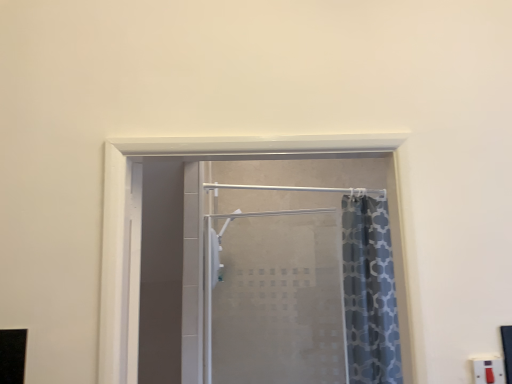
The image size is (512, 384). What do you see at coordinates (290, 275) in the screenshot?
I see `frosted glass shower door at center` at bounding box center [290, 275].

Find the location of `frosted glass shower door at center`. frosted glass shower door at center is located at coordinates pyautogui.click(x=290, y=275).

The width and height of the screenshot is (512, 384). What do you see at coordinates (488, 370) in the screenshot?
I see `white plastic electric outlet at lower right` at bounding box center [488, 370].

Find the location of a particular element. The image size is (512, 384). white plastic electric outlet at lower right is located at coordinates (488, 370).

Where is `frosted glass shower door at center`? frosted glass shower door at center is located at coordinates (290, 275).

Would you say frosted glass shower door at center is to the left or to the right of white plastic electric outlet at lower right in the picture?

In the image, frosted glass shower door at center appears on the left side of white plastic electric outlet at lower right.

Is frosted glass shower door at center in front of or behind white plastic electric outlet at lower right in the image?

In the image, frosted glass shower door at center appears behind white plastic electric outlet at lower right.

Does point (289, 316) come farther from viewer compared to point (487, 370)?

Yes, it is behind point (487, 370).

From the image's perspective, is frosted glass shower door at center over white plastic electric outlet at lower right?

No, from the image's perspective, frosted glass shower door at center is not over white plastic electric outlet at lower right.

In the scene shown: From a real-world perspective, does frosted glass shower door at center stand above white plastic electric outlet at lower right?

Correct, in the physical world, frosted glass shower door at center is higher than white plastic electric outlet at lower right.

Which of these two, frosted glass shower door at center or white plastic electric outlet at lower right, is wider?

frosted glass shower door at center.

Which of these two, frosted glass shower door at center or white plastic electric outlet at lower right, stands taller?

frosted glass shower door at center.

Which of these two, frosted glass shower door at center or white plastic electric outlet at lower right, is bigger?

With larger size is frosted glass shower door at center.

Choose the correct answer: Is frosted glass shower door at center inside white plastic electric outlet at lower right or outside it?

The correct answer is: outside.

Is frosted glass shower door at center far from white plastic electric outlet at lower right?

Absolutely, frosted glass shower door at center is distant from white plastic electric outlet at lower right.

Based on the photo, does frosted glass shower door at center turn towards white plastic electric outlet at lower right?

No, frosted glass shower door at center is not facing towards white plastic electric outlet at lower right.

Find the location of `electric outlet below the frosted glass shower door at center (from a real-world perspective)`. electric outlet below the frosted glass shower door at center (from a real-world perspective) is located at coordinates (488, 370).

Is white plastic electric outlet at lower right at the left side of frosted glass shower door at center?

No.

Considering the relative positions of white plastic electric outlet at lower right and frosted glass shower door at center in the image provided, is white plastic electric outlet at lower right in front of frosted glass shower door at center?

Yes, the depth of white plastic electric outlet at lower right is less than that of frosted glass shower door at center.

Which point is more distant from viewer, (483, 379) or (316, 281)?

Point (316, 281)

From the image's perspective, is white plastic electric outlet at lower right positioned above or below frosted glass shower door at center?

Based on their image positions, white plastic electric outlet at lower right is located above frosted glass shower door at center.

From a real-world perspective, between white plastic electric outlet at lower right and frosted glass shower door at center, who is vertically lower?

In real-world perspective, white plastic electric outlet at lower right is lower.

Does white plastic electric outlet at lower right have a lesser width compared to frosted glass shower door at center?

Correct, the width of white plastic electric outlet at lower right is less than that of frosted glass shower door at center.

Between white plastic electric outlet at lower right and frosted glass shower door at center, which one has more height?

With more height is frosted glass shower door at center.

Which of these two, white plastic electric outlet at lower right or frosted glass shower door at center, is smaller?

white plastic electric outlet at lower right is smaller.

Is white plastic electric outlet at lower right not within frosted glass shower door at center?

Yes, white plastic electric outlet at lower right is outside of frosted glass shower door at center.

Is white plastic electric outlet at lower right next to frosted glass shower door at center and touching it?

white plastic electric outlet at lower right is not next to frosted glass shower door at center, and they're not touching.

Is white plastic electric outlet at lower right aimed at frosted glass shower door at center?

No, white plastic electric outlet at lower right is not facing towards frosted glass shower door at center.

How different are the orientations of white plastic electric outlet at lower right and frosted glass shower door at center in degrees?

22.2 degrees separate the facing orientations of white plastic electric outlet at lower right and frosted glass shower door at center.

The height and width of the screenshot is (384, 512). In order to click on door behind the white plastic electric outlet at lower right in this screenshot , I will do `click(290, 275)`.

Locate an element on the screen. door below the white plastic electric outlet at lower right (from the image's perspective) is located at coordinates (290, 275).

Where is `electric outlet located in front of the frosted glass shower door at center`? The height and width of the screenshot is (384, 512). electric outlet located in front of the frosted glass shower door at center is located at coordinates (488, 370).